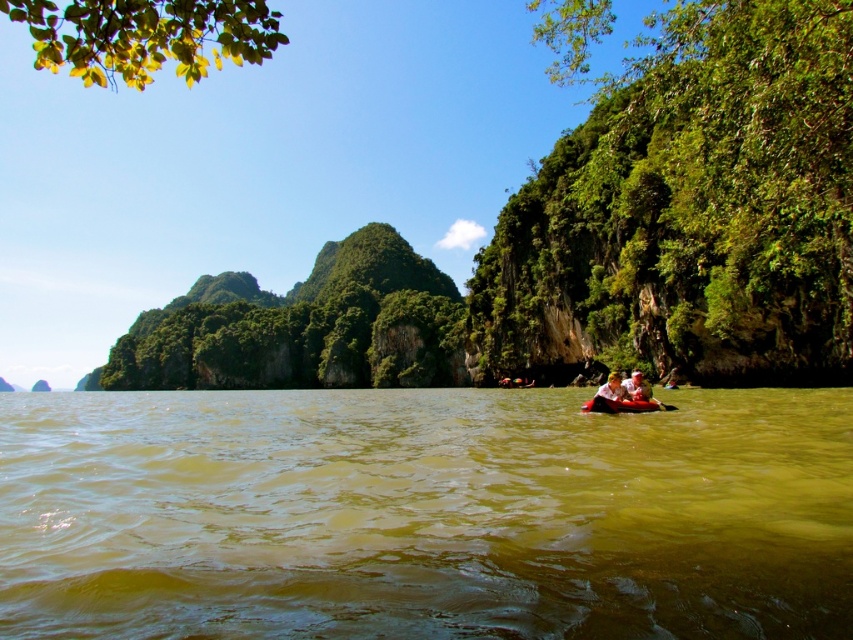
You are standing on the shore of the murky greenish water and see the point marked at coordinates (637,387). What object is located at that exact point?

The point marked at coordinates (637,387) corresponds to the white cotton shirt at lower right.

You are standing on the dock and see the brown murky water at center and the white cotton shirt at lower right. Which object is closer to your left side?

The brown murky water at center is to the left of the white cotton shirt at lower right, so the brown murky water at center is closer to your left side.